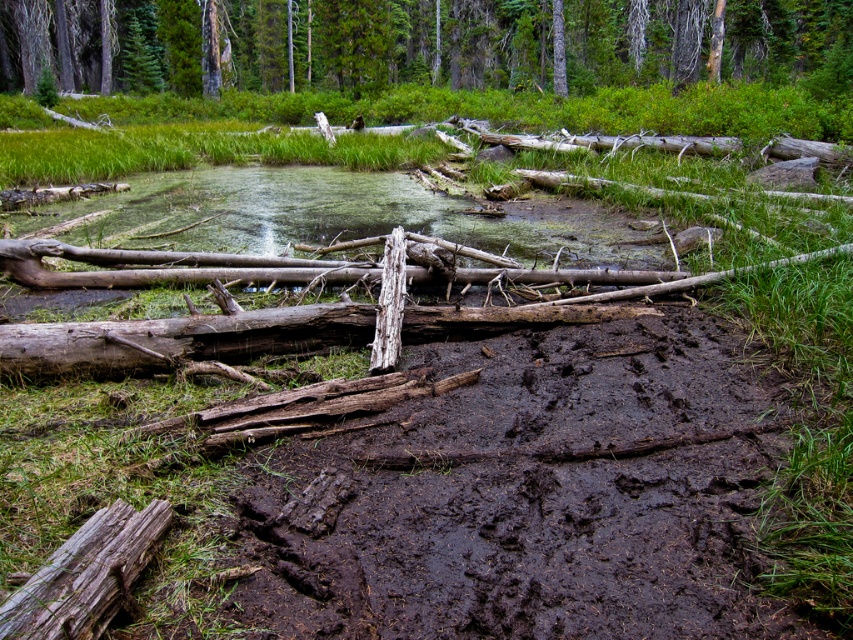
You are standing at the point marked by the coordinates point (526,497) in the forest scene. What is the immediate surface you are standing on?

The dark brown mud at center is located at point (526,497), so you are standing on dark brown mud at center.

You are a hiker trying to cross the muddy path. You notice a point marked at coordinates (526,497). What is located at that point?

At point (526,497) lies dark brown mud at center.

You are a hiker trying to navigate through the forest. You see the dark brown mud at center and the green matte tree at upper center. Which object is located to the right of the other?

The dark brown mud at center is positioned on the right side of green matte tree at upper center.